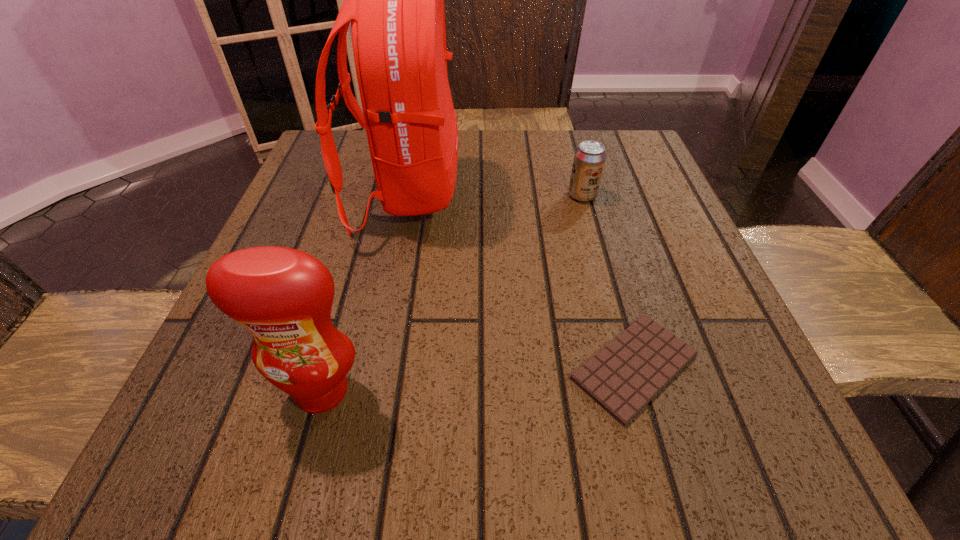
Locate an element on the screen. The height and width of the screenshot is (540, 960). the tallest object is located at coordinates (395, 0).

I want to click on condiment, so click(283, 296).

Find the location of a particular element. the second shortest object is located at coordinates (589, 160).

Where is `chocolate bar`? chocolate bar is located at coordinates (623, 377).

The image size is (960, 540). Identify the location of vacant area situated 0.260m on the main compartment of the tallest object. tap(583, 193).

Find the location of a particular element. free region located on the label side of the third shortest object is located at coordinates (301, 464).

Locate an element on the screen. vacant point located 0.240m on the back of the third tallest object is located at coordinates (565, 132).

You are a GUI agent. You are given a task and a screenshot of the screen. Output one action in this format:
    pyautogui.click(x=<x>, y=<y>)
    Task: Click on the vacant point located 0.350m on the left of the shortest object
    The height and width of the screenshot is (540, 960).
    Given the screenshot: What is the action you would take?
    pyautogui.click(x=324, y=367)

The width and height of the screenshot is (960, 540). Find the location of `object that is at the far edge`. object that is at the far edge is located at coordinates (395, 0).

Image resolution: width=960 pixels, height=540 pixels. Identify the location of condiment that is at the near edge. pyautogui.click(x=283, y=296).